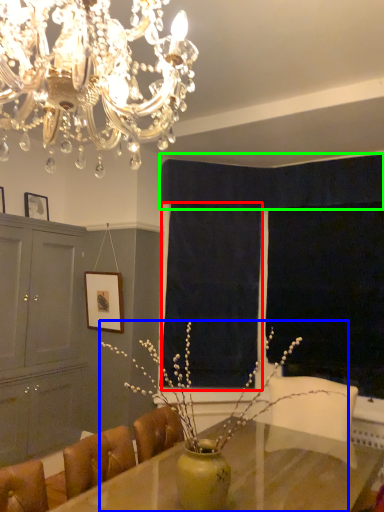
Question: Estimate the real-world distances between objects in this image. Which object is farther from curtain (highlighted by a red box), houseplant (highlighted by a blue box) or curtain (highlighted by a green box)?

Choices:
 (A) houseplant
 (B) curtain

Answer: (B)